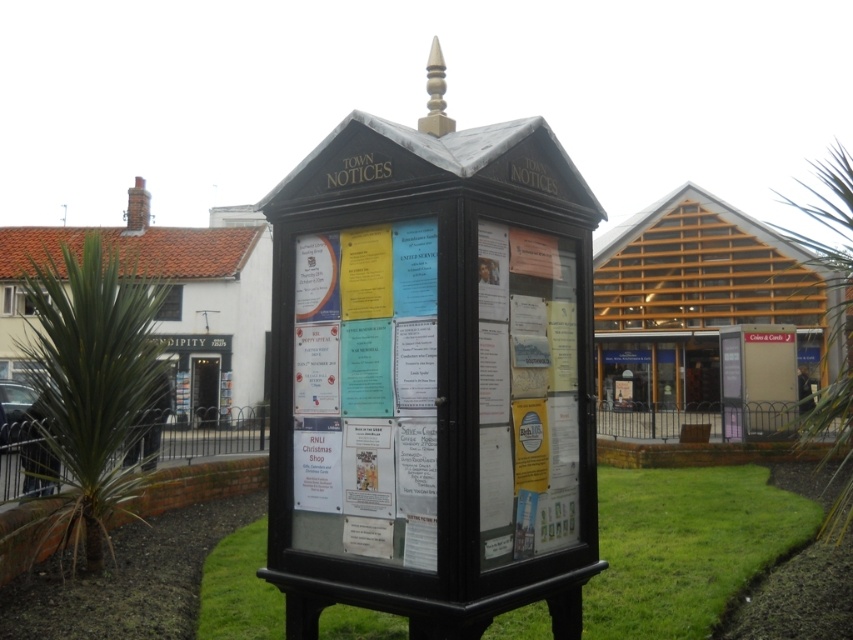
You are a gardener who needs to mow the green grass at lower center. However, you have a lawnmower that is 1.2 meters wide. Can you safely operate the lawnmower around the white paper posters at center without hitting them? Explain why or why not.

The white paper posters at center is much taller than green grass at lower center. Since the posters are taller, they might extend above the height of the lawnmower blades. However, the question is about width, not height. The lawnmower width is 1.2 meters, but there is no information provided about the horizontal space between the posters and the grass area. Therefore, it is unclear if there is enough space to maneuver safely. The answer cannot be determined with the given information.

What is located at the coordinates point (369, 388) on the notice board?

The point (369, 388) marks white paper posters at center.

You are standing in front of the notice board and want to place a new poster. The white paper posters at center are already there. Where should you place your new poster if you want it to be closer to the viewer than the green grass at lower center?

You should place your new poster near the white paper posters at center because they are already closer to the viewer than the green grass at lower center, so placing it there will ensure it is also closer.